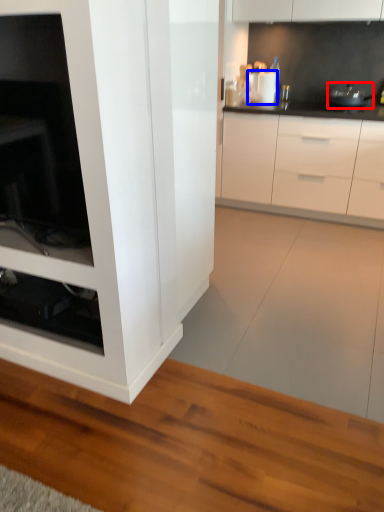
Question: Among these objects, which one is farthest to the camera, appliance (highlighted by a red box) or appliance (highlighted by a blue box)?

Choices:
 (A) appliance
 (B) appliance

Answer: (B)